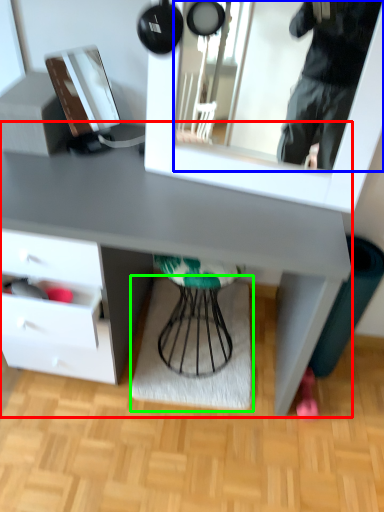
Question: Which is nearer to the desk (highlighted by a red box)? mirror (highlighted by a blue box) or mat (highlighted by a green box).

Choices:
 (A) mirror
 (B) mat

Answer: (B)